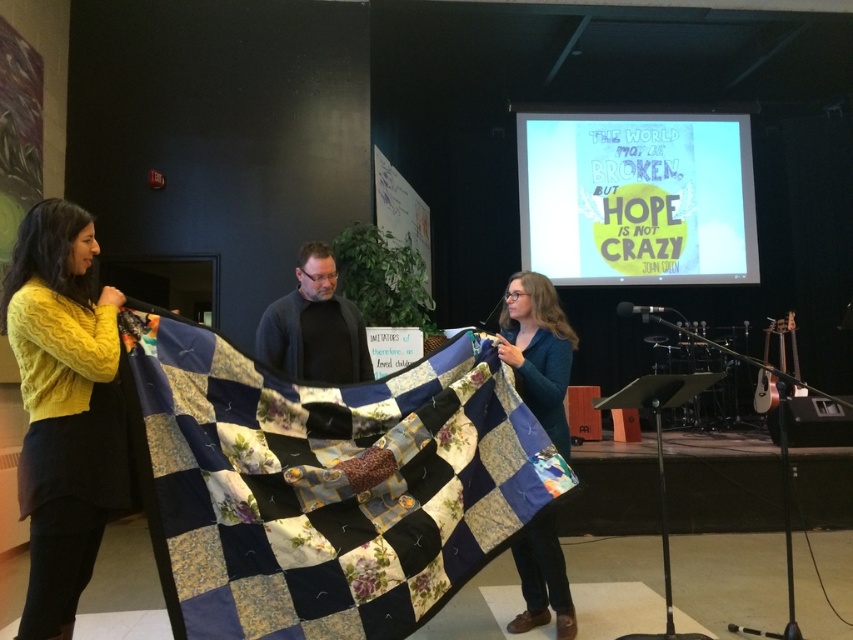
Identify the location of patchwork quilt at center. (326, 484).

Does patchwork quilt at center have a greater width compared to dark gray sweater at center?

Correct, the width of patchwork quilt at center exceeds that of dark gray sweater at center.

What do you see at coordinates (326, 484) in the screenshot?
I see `patchwork quilt at center` at bounding box center [326, 484].

Identify the location of patchwork quilt at center. (326, 484).

Is patchwork quilt at center to the right of cable-knit sweater at left from the viewer's perspective?

Yes, patchwork quilt at center is to the right of cable-knit sweater at left.

Can you confirm if patchwork quilt at center is shorter than cable-knit sweater at left?

Yes, patchwork quilt at center is shorter than cable-knit sweater at left.

I want to click on patchwork quilt at center, so click(x=326, y=484).

Between point (35, 294) and point (299, 371), which one is positioned in front?

Point (35, 294) is in front.

Where is `cable-knit sweater at left`? cable-knit sweater at left is located at coordinates (64, 408).